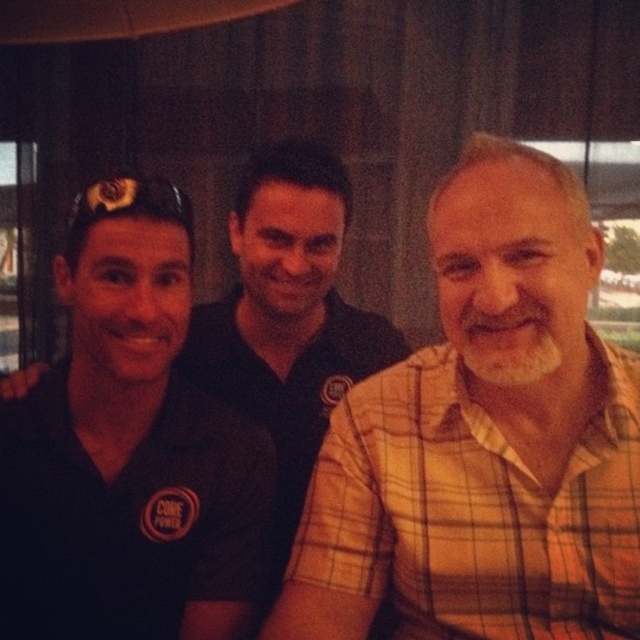
You are a photographer trying to adjust the lighting for a group photo. You notice two shirts in the center of the image, a plaid cotton shirt at center and a black matte shirt at center. Which shirt is located to the right of the other?

The plaid cotton shirt at center is positioned on the right side of the black matte shirt at center.

You are trying to decide which shirt to wear for an event. You see the plaid cotton shirt at center and the black matte shirt at center in the photo. Which shirt is closer to the bottom of the image?

The plaid cotton shirt at center is positioned under the black matte shirt at center, so it is closer to the bottom of the image.

You are standing in the scene and want to hand a small gift to the person wearing the plaid cotton shirt at center without moving. Can you reach them?

The plaid cotton shirt at center and viewer are 28.41 inches apart, so yes, you can reach them without moving because the distance is within arm reach.